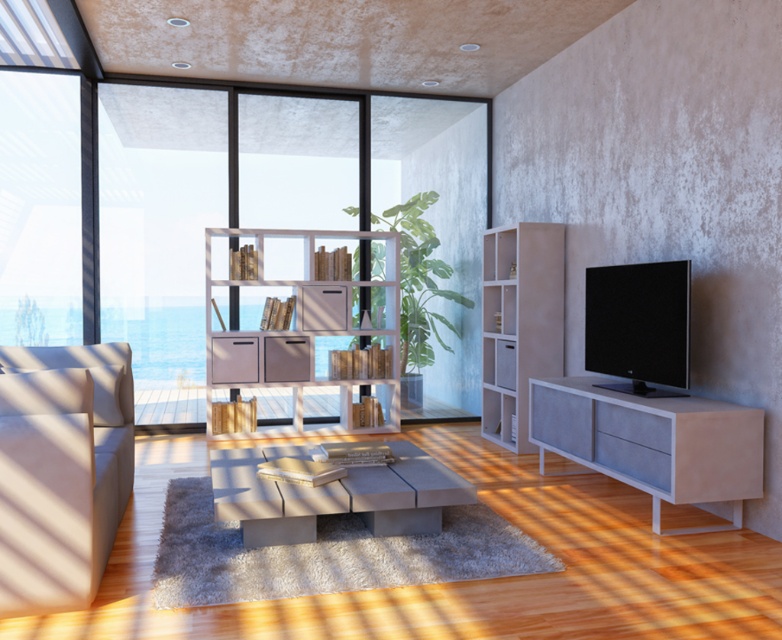
You are sitting on the beige fabric couch at left and want to look outside through the transparent glass window at left. Can you see the ocean view through the window from your current position?

The beige fabric couch at left is behind the transparent glass window at left, so you can look through the window and see the ocean view from your current position on the beige fabric couch at left.

You are organizing a bookshelf in the living room. You have two bookshelves available, the wooden bookshelf at center and the white textured bookshelf at center. Which one should you choose if you need a larger storage space?

The wooden bookshelf at center is bigger than the white textured bookshelf at center, so you should choose the wooden bookshelf at center for larger storage space.

You are arranging a new sofa in the living room and need to place it between the slate gray concrete cabinet at lower right and the white textured bookshelf at center. Which side of the bookshelf should the cabinet be placed on?

The slate gray concrete cabinet at lower right is positioned on the right side of the white textured bookshelf at center, so it should be placed to the right of the bookshelf.